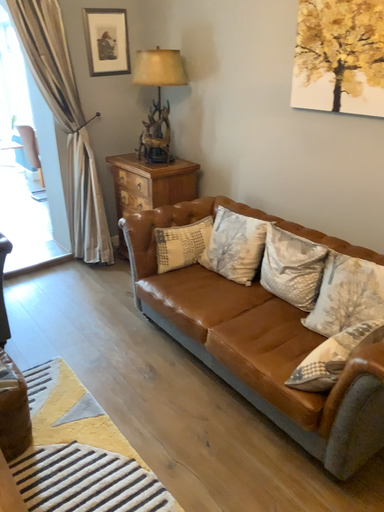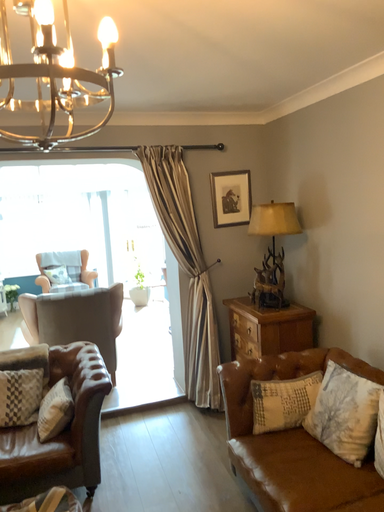
Question: How did the camera likely rotate when shooting the video?

Choices:
 (A) rotated downward
 (B) rotated upward

Answer: (B)